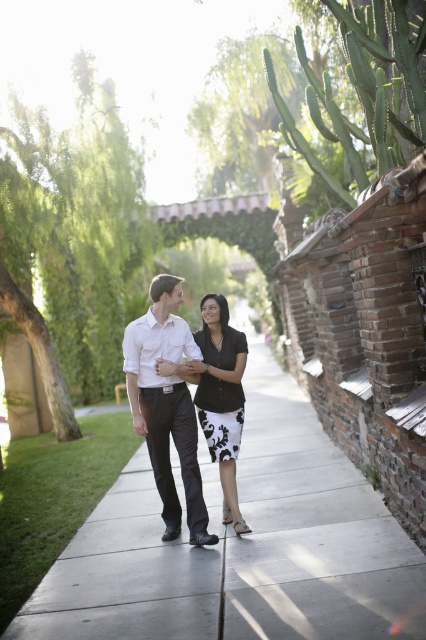
You are a photographer aiming to capture a clear shot of both the white satin shirt at center and the black matte dress at center. However, you notice that one of the items is partially blocking the other. Which clothing item is obstructing the view of the other?

The white satin shirt at center is positioned over the black matte dress at center, meaning the white satin shirt is obstructing the view of the black matte dress.

You are a photographer standing at the end of the pathway. You want to capture a photo of the two people walking along the smooth concrete sidewalk at center and the black textured dress at center. Which object is closer to the camera in the image?

The smooth concrete sidewalk at center is positioned under the black textured dress at center, so the black textured dress at center is closer to the camera.